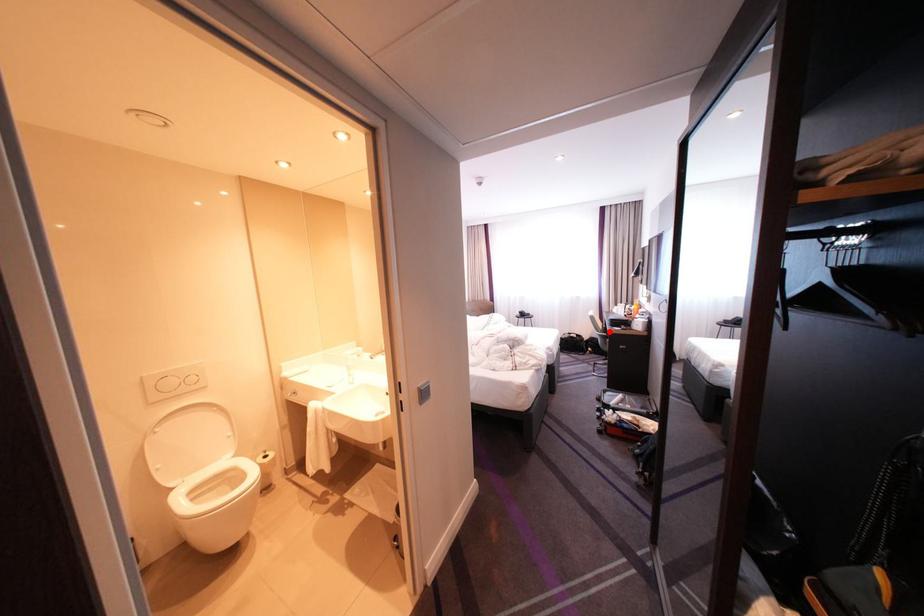
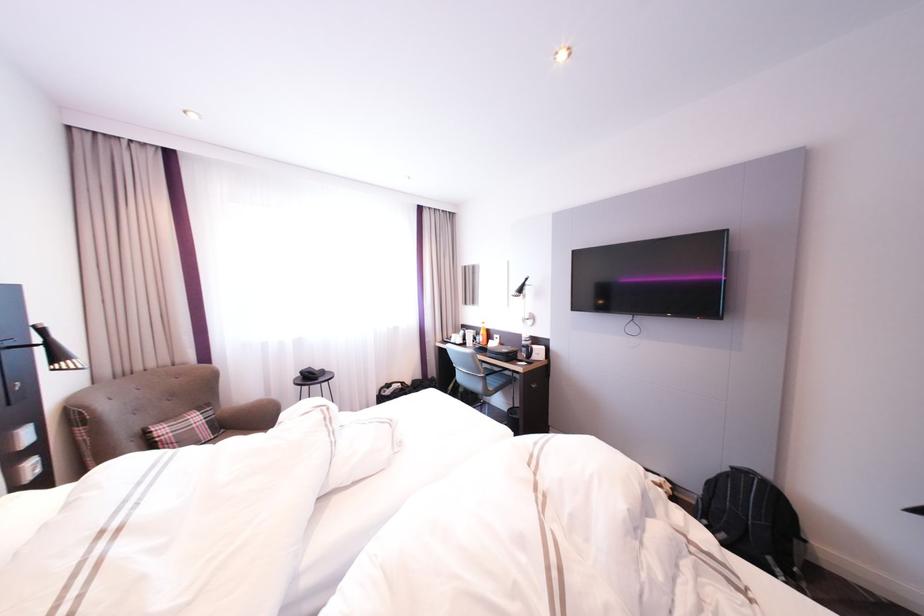
Locate, in the second image, the point that corresponds to the highlighted location in the first image.

(492, 373)